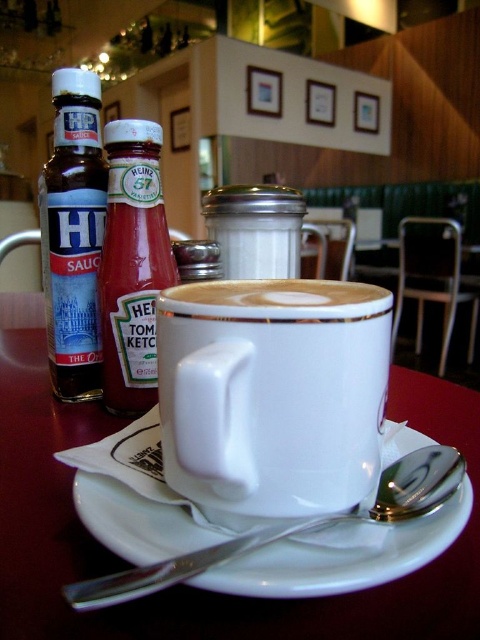
Between point (364, 284) and point (395, 396), which one is positioned in front?

Positioned in front is point (364, 284).

Which is behind, point (324, 429) or point (360, 630)?

Positioned behind is point (324, 429).

Does point (179, 310) come farther from viewer compared to point (45, 554)?

No.

Where is `white glossy mug at center`? white glossy mug at center is located at coordinates (273, 392).

Can you confirm if red glass bottle of ketchup at left is thinner than white matte cup at center?

Indeed, red glass bottle of ketchup at left has a lesser width compared to white matte cup at center.

How much distance is there between red glass bottle of ketchup at left and white matte cup at center?

The distance of red glass bottle of ketchup at left from white matte cup at center is 4.83 inches.

The width and height of the screenshot is (480, 640). I want to click on red glass bottle of ketchup at left, so (x=132, y=266).

You are a GUI agent. You are given a task and a screenshot of the screen. Output one action in this format:
    pyautogui.click(x=<x>, y=<y>)
    Task: Click on the red glass bottle of ketchup at left
    
    Given the screenshot: What is the action you would take?
    pyautogui.click(x=132, y=266)

Who is more distant from viewer, (205,618) or (384,502)?

Point (384,502)

This screenshot has width=480, height=640. What do you see at coordinates (184, 586) in the screenshot? I see `white ceramic mug at center` at bounding box center [184, 586].

Find the location of a particular element. This screenshot has height=640, width=480. white ceramic mug at center is located at coordinates (184, 586).